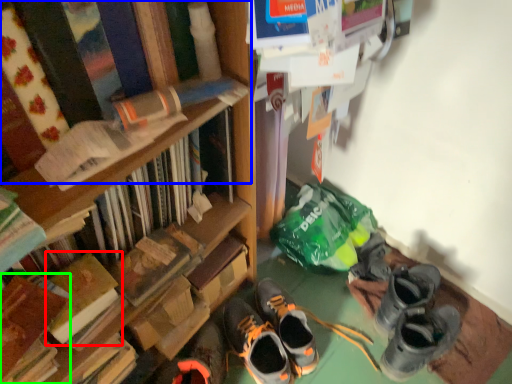
Question: Which is nearer to the book (highlighted by a red box)? book (highlighted by a blue box) or book (highlighted by a green box).

Choices:
 (A) book
 (B) book

Answer: (B)